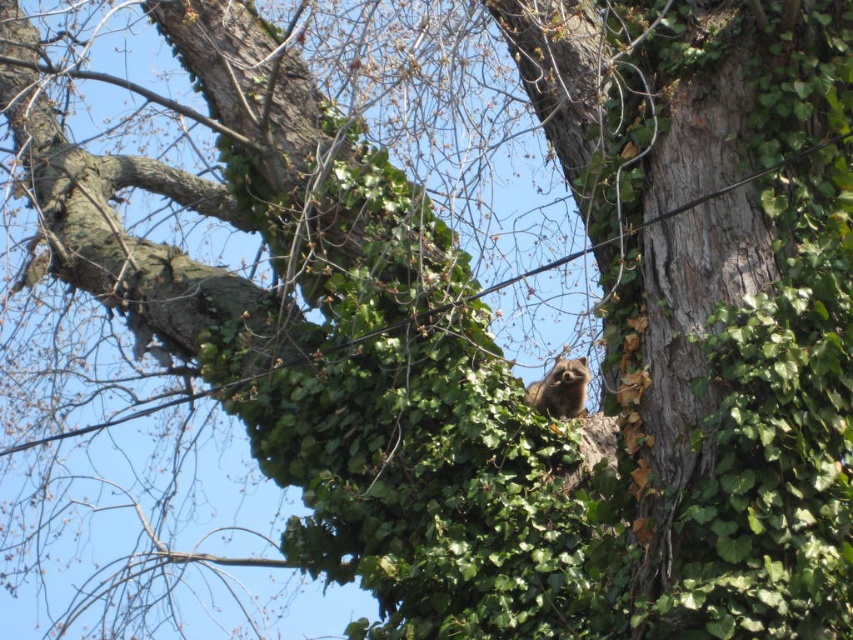
Between brown rough bark at center and fuzzy brown squirrel at center-right, which one appears on the right side from the viewer's perspective?

brown rough bark at center

The height and width of the screenshot is (640, 853). In order to click on brown rough bark at center in this screenshot , I will do `click(691, 284)`.

Where is `brown rough bark at center`? This screenshot has height=640, width=853. brown rough bark at center is located at coordinates (691, 284).